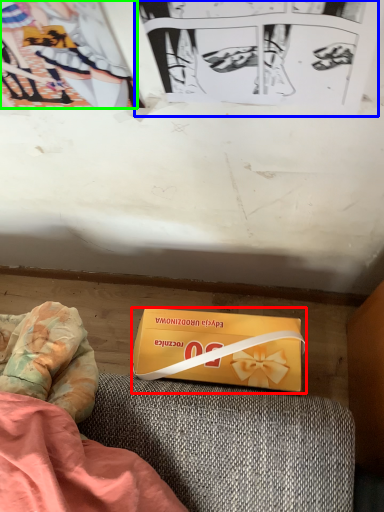
Question: Considering the real-world distances, which object is farthest from box (highlighted by a red box)? paperback book (highlighted by a blue box) or couple (highlighted by a green box)?

Choices:
 (A) paperback book
 (B) couple

Answer: (B)